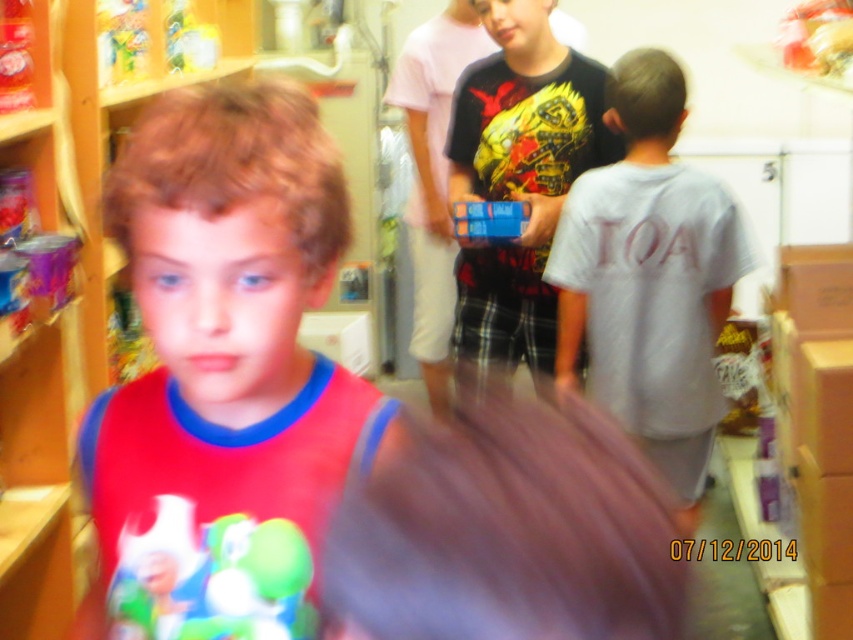
Question: Considering the relative positions of matte red t-shirt at left and gray cotton shirt at right in the image provided, where is matte red t-shirt at left located with respect to gray cotton shirt at right?

Choices:
 (A) above
 (B) below

Answer: (B)

Question: Among these objects, which one is nearest to the camera?

Choices:
 (A) blue plastic toy at center
 (B) gray cotton shirt at right
 (C) matte plastic toy at center

Answer: (C)

Question: Which object is positioned closest to the matte red t-shirt at left?

Choices:
 (A) matte black t-shirt at center
 (B) blue plastic toy at center
 (C) gray cotton shirt at right
 (D) matte plastic toy at center

Answer: (D)

Question: Can you confirm if wooden bookshelf at left is positioned to the right of blue plastic toy at center?

Choices:
 (A) no
 (B) yes

Answer: (A)

Question: Which point is farther to the camera?

Choices:
 (A) (442, 504)
 (B) (555, 100)
 (C) (305, 497)
 (D) (227, 632)

Answer: (B)

Question: Is matte red t-shirt at left positioned before wooden bookshelf at left?

Choices:
 (A) yes
 (B) no

Answer: (A)